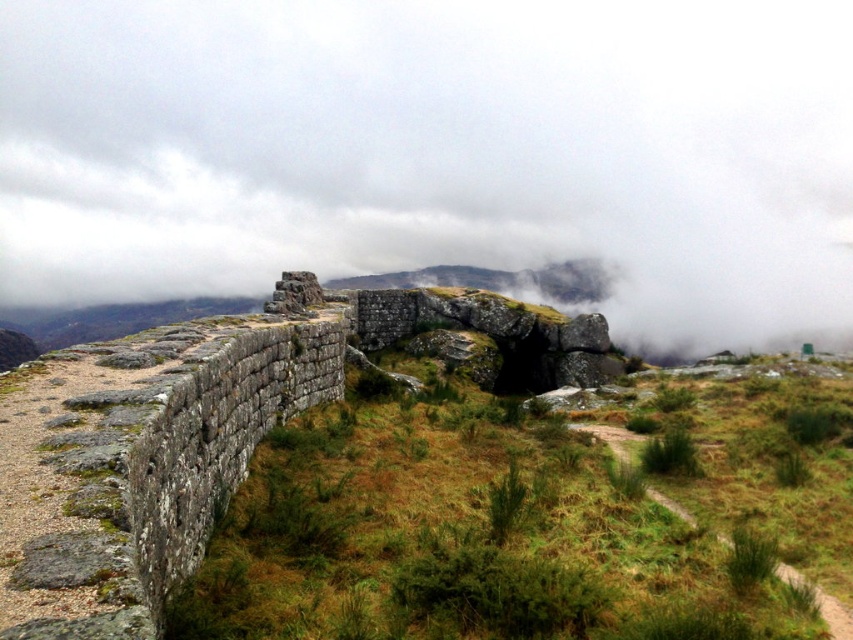
Question: Observing the image, what is the correct spatial positioning of green grassy at left in reference to green grass at center?

Choices:
 (A) left
 (B) right

Answer: (A)

Question: Based on their relative distances, which object is nearer to the brown dirt path at lower right?

Choices:
 (A) green grassy at left
 (B) green grass at center
 (C) white fluffy cloud at upper center

Answer: (B)

Question: Can you confirm if brown dirt path at lower right is positioned to the right of green grass at center?

Choices:
 (A) no
 (B) yes

Answer: (A)

Question: Is green grassy at left below brown dirt path at lower right?

Choices:
 (A) yes
 (B) no

Answer: (B)

Question: Which is nearer to the brown dirt path at lower right?

Choices:
 (A) green grassy at left
 (B) white fluffy cloud at upper center
 (C) green grass at center

Answer: (C)

Question: Which point is farther to the camera?

Choices:
 (A) green grass at center
 (B) green grassy at left
 (C) white fluffy cloud at upper center

Answer: (C)